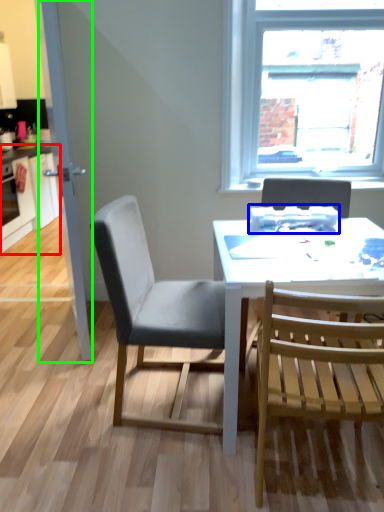
Question: Which object is the farthest from cabinetry (highlighted by a red box)? Choose among these: appliance (highlighted by a blue box) or glass door (highlighted by a green box).

Choices:
 (A) appliance
 (B) glass door

Answer: (A)